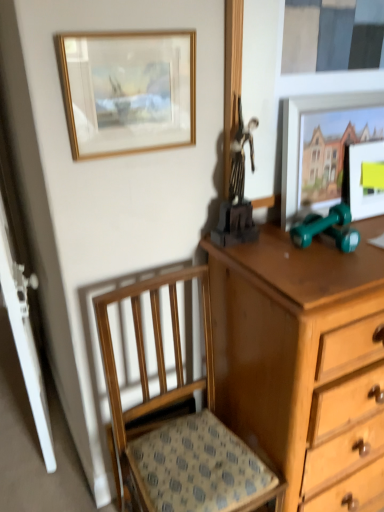
What are the coordinates of `empty space that is ontop of matte wooden picture frame at upper right, positioned as the 2th picture frame in right-to-left order (from a real-world perspective)` in the screenshot? It's located at [350, 88].